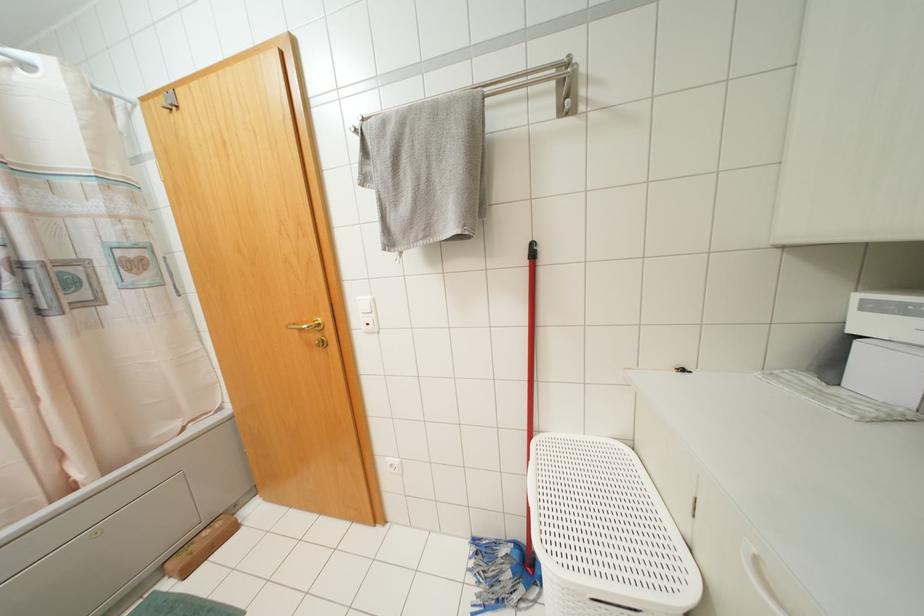
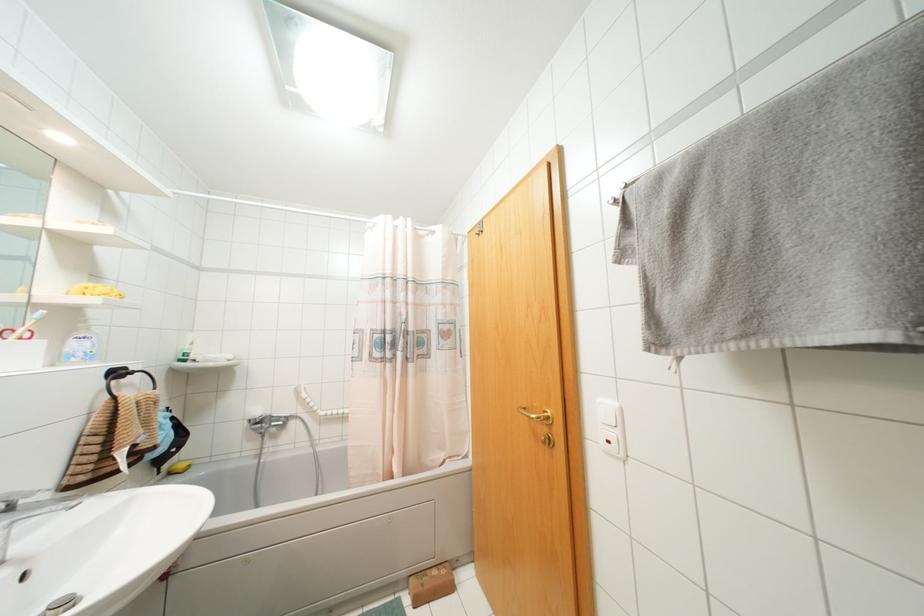
In the second image, find the point that corresponds to [371,315] in the first image.

(617, 431)